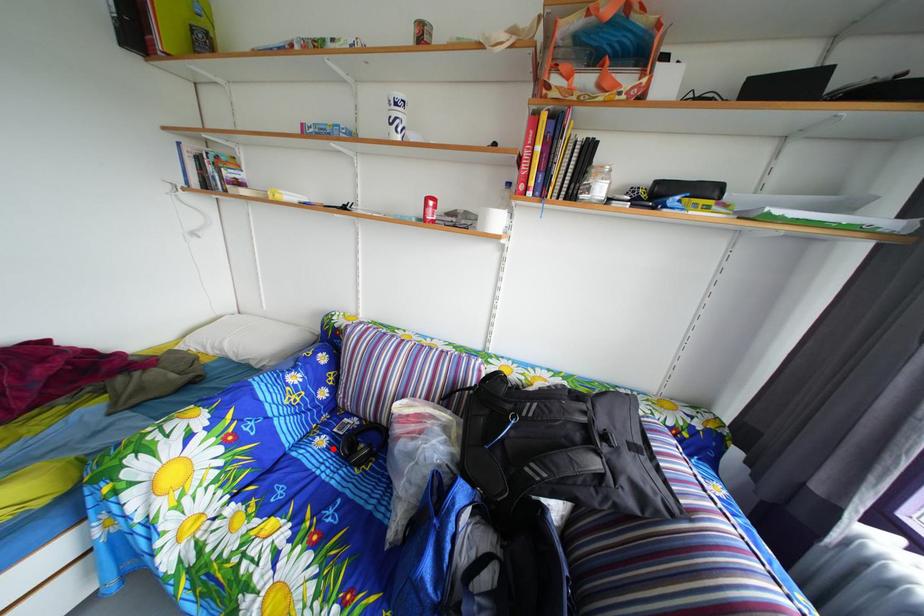
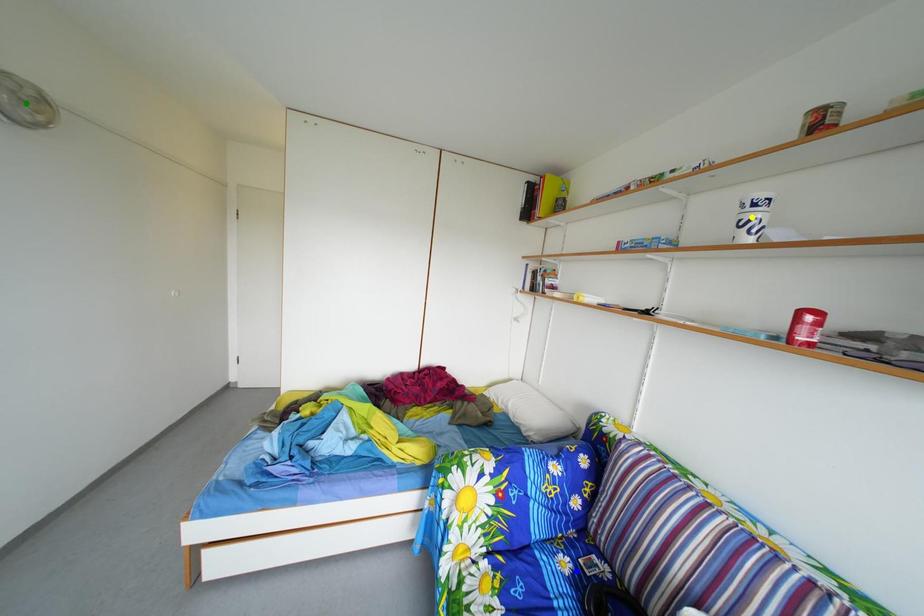
Question: I am providing you with two images of the same scene from different viewpoints. A red point is marked on the first image. You are given multiple points on the second image. Which point in image 2 is actually the same real-world point as the red point in image 1?

Choices:
 (A) blue point
 (B) yellow point
 (C) green point

Answer: (A)